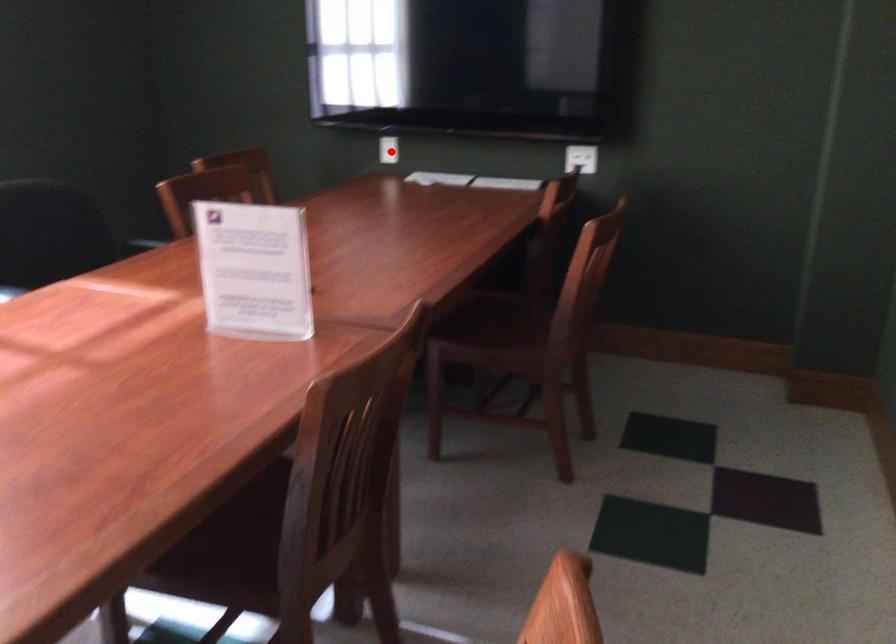
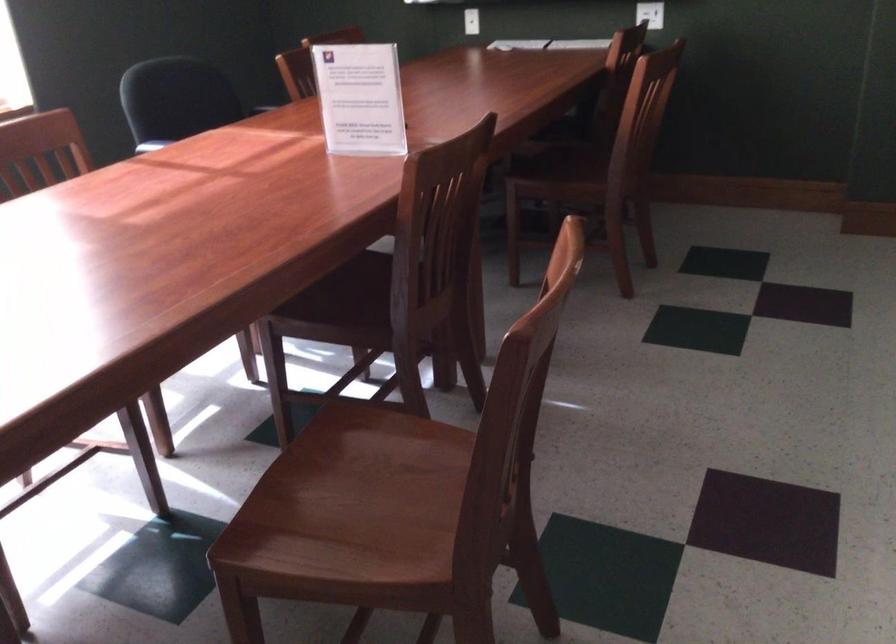
The point at the highlighted location is marked in the first image. Where is the corresponding point in the second image?

(471, 21)